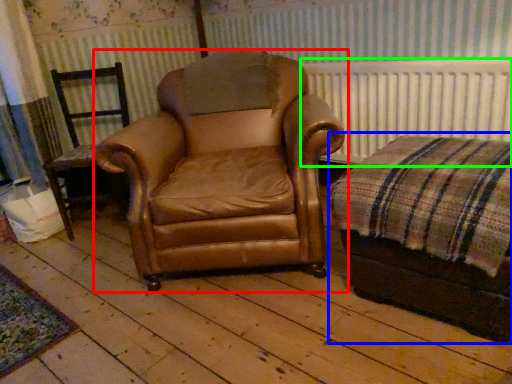
Question: Which is farther away from chair (highlighted by a red box)? couch (highlighted by a blue box) or radiator (highlighted by a green box)?

Choices:
 (A) couch
 (B) radiator

Answer: (B)